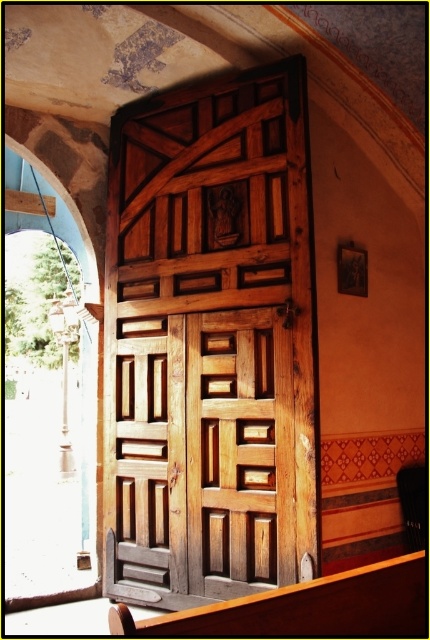
You are a painter who needs to move a 1.2 meter wide canvas to the other side of the natural wood door at center. The wooden polished bench at lower center is in the way. Can you move the canvas around the bench and through the door without tilting it?

The natural wood door at center is wider than the wooden polished bench at lower center. Since the canvas is 1.2 meters wide, it can fit through the door if the door width is greater than 1.2 meters. However, the bench width is narrower than the door. If the bench is positioned along the path, you might need to move it or navigate around it. Without knowing the exact door width, it is uncertain if the canvas will fit. However, since the door is wider than the bench, if the bench can be moved, there might be

You are a person who is 5 feet tall and want to reach the handle of the natural wood door at center from the wooden polished bench at lower center. The bench is 1 foot high. Can you comfortably reach the handle if you stand on the bench?

The distance between the natural wood door at center and wooden polished bench at lower center is 6.58 feet. Since the bench is only 1 foot high, standing on it would give you a total reach of 6 feet. The door handle is likely positioned at a standard height of around 3.5 to 4 feet, so you would still be able to comfortably reach it while standing on the bench.